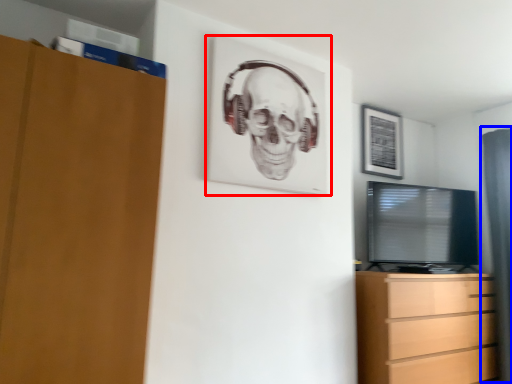
Question: Which point is further to the camera, picture frame (highlighted by a red box) or curtain (highlighted by a blue box)?

Choices:
 (A) picture frame
 (B) curtain

Answer: (B)